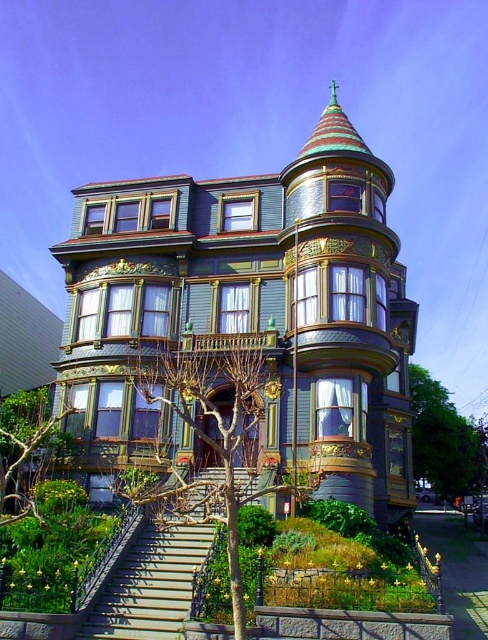
How much distance is there between bare branches at center and green leafy tree at lower left?

bare branches at center and green leafy tree at lower left are 27.63 feet apart.

Who is taller, bare branches at center or green leafy tree at lower left?

bare branches at center

Find the location of a particular element. This screenshot has height=640, width=488. bare branches at center is located at coordinates (207, 433).

Identify the location of bare branches at center. (207, 433).

Is bare branches at center wider than green leafy tree at lower right?

In fact, bare branches at center might be narrower than green leafy tree at lower right.

Between point (241, 598) and point (413, 416), which one is positioned behind?

Positioned behind is point (413, 416).

Locate an element on the screen. This screenshot has width=488, height=640. bare branches at center is located at coordinates (207, 433).

Between green leafy tree at lower right and green leafy tree at lower left, which one appears on the left side from the viewer's perspective?

From the viewer's perspective, green leafy tree at lower left appears more on the left side.

Is green leafy tree at lower right to the left of green leafy tree at lower left from the viewer's perspective?

Incorrect, green leafy tree at lower right is not on the left side of green leafy tree at lower left.

Where is `green leafy tree at lower right`? Image resolution: width=488 pixels, height=640 pixels. green leafy tree at lower right is located at coordinates (445, 440).